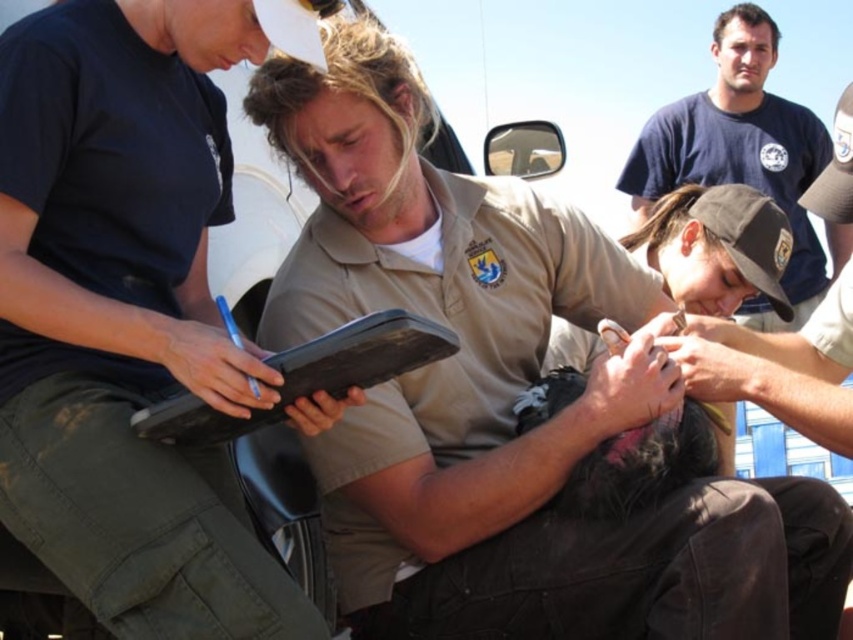
Looking at this image, based on the scene description, where is the matte khaki shirt at center located in the image?

The matte khaki shirt at center is located at the 2D coordinates point (126, 317).